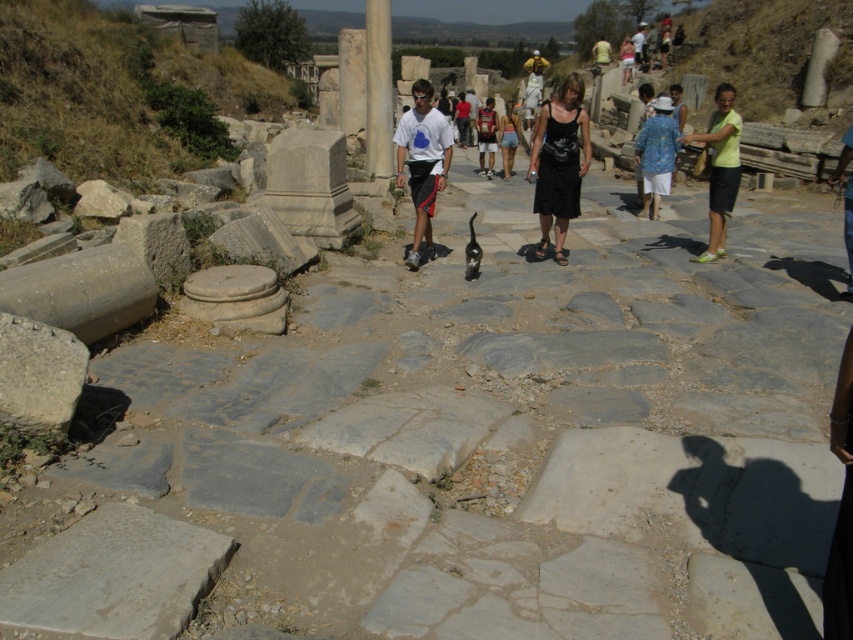
Does white marble pillar at center have a larger size compared to matte black dress at center?

No, white marble pillar at center is not bigger than matte black dress at center.

Can you confirm if white marble pillar at center is thinner than matte black dress at center?

Yes, white marble pillar at center is thinner than matte black dress at center.

Which is behind, point (376, 166) or point (509, 172)?

The point (509, 172) is behind.

The width and height of the screenshot is (853, 640). In order to click on white marble pillar at center in this screenshot , I will do `click(378, 90)`.

Who is more forward, (650, 177) or (506, 131)?

Point (650, 177) is more forward.

Between blue printed shirt at center and matte black dress at center, which one is positioned lower?

blue printed shirt at center is lower down.

Where is `blue printed shirt at center`? The width and height of the screenshot is (853, 640). blue printed shirt at center is located at coordinates (656, 154).

Does black cotton dress at center have a lesser height compared to matte black dress at center?

Indeed, black cotton dress at center has a lesser height compared to matte black dress at center.

Can you confirm if black cotton dress at center is smaller than matte black dress at center?

Yes, black cotton dress at center is smaller than matte black dress at center.

This screenshot has width=853, height=640. Find the location of `black cotton dress at center`. black cotton dress at center is located at coordinates (560, 163).